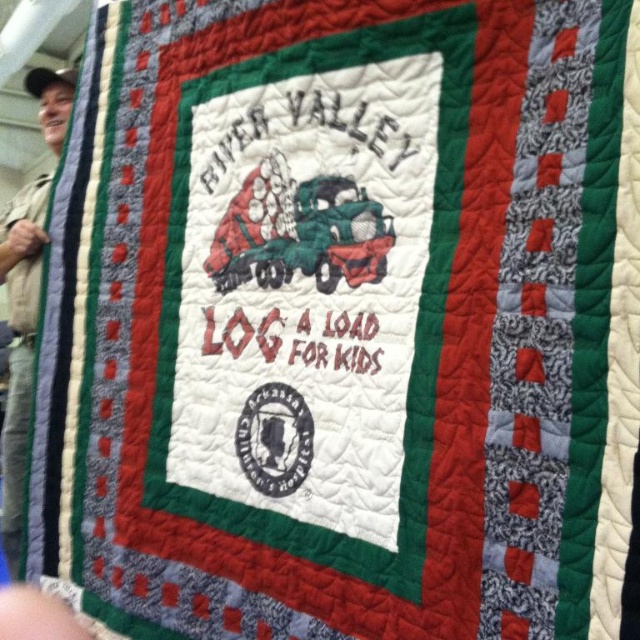
You are an observer looking at the quilt. You notice the green matte truck at center and the brown fabric shirt at left. Which object is located to the right of the other?

The green matte truck at center is positioned on the right side of brown fabric shirt at left.

You are a tailor measuring the quilt to ensure proper framing. Given the green matte truck at center and the brown fabric shirt at left, which object is wider?

The green matte truck at center is wider than the brown fabric shirt at left as stated in the description.